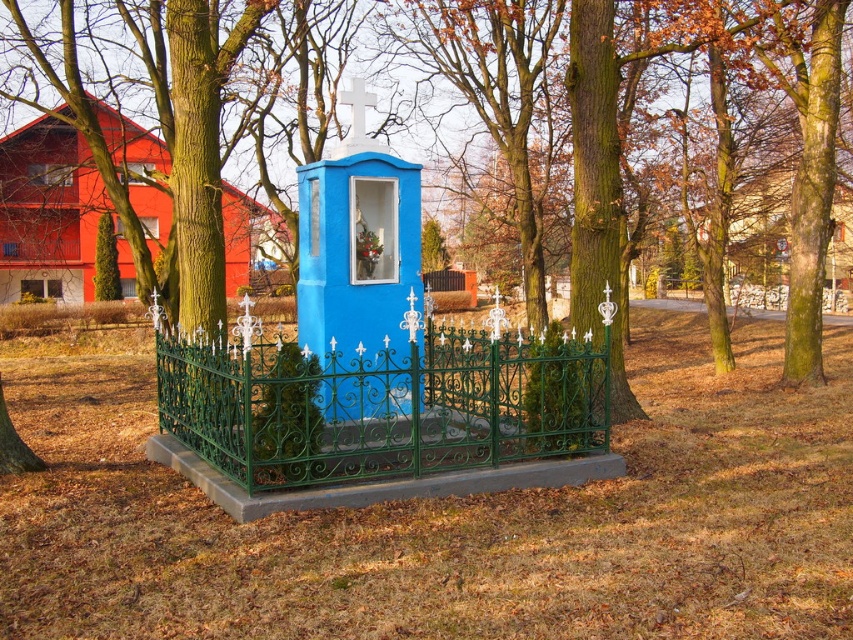
Question: Among these objects, which one is farthest from the camera?

Choices:
 (A) green textured fence at center
 (B) blue painted wood gazebo at center

Answer: (A)

Question: Among these objects, which one is nearest to the camera?

Choices:
 (A) green wrought iron fence at center
 (B) green textured fence at center

Answer: (A)

Question: Among these points, which one is farthest from the camera?

Choices:
 (A) (827, 204)
 (B) (360, 440)

Answer: (A)

Question: Does green textured fence at center have a smaller size compared to blue painted wood gazebo at center?

Choices:
 (A) yes
 (B) no

Answer: (B)

Question: Can you confirm if green wrought iron fence at center is bigger than blue painted wood gazebo at center?

Choices:
 (A) no
 (B) yes

Answer: (A)

Question: Does green textured fence at center have a lesser width compared to blue painted wood gazebo at center?

Choices:
 (A) yes
 (B) no

Answer: (B)